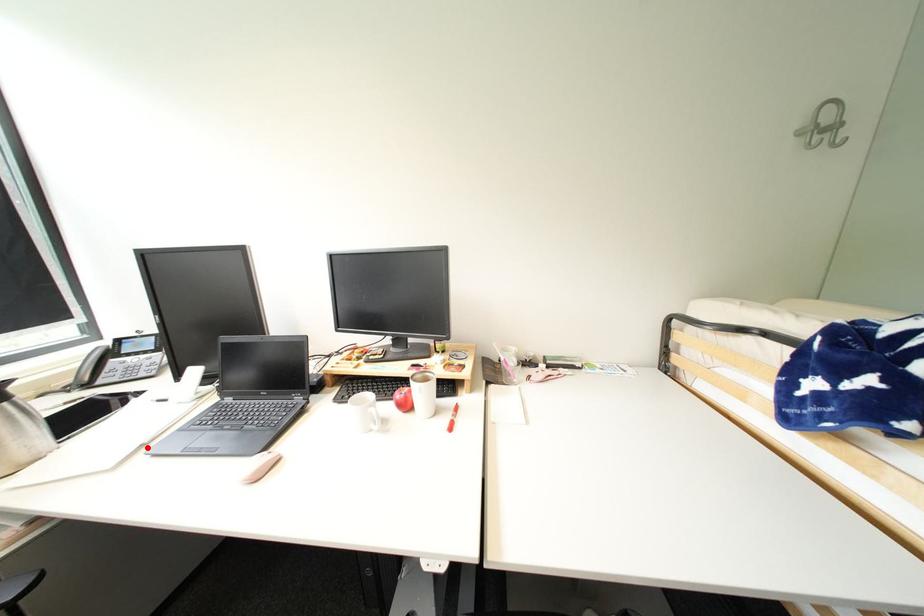
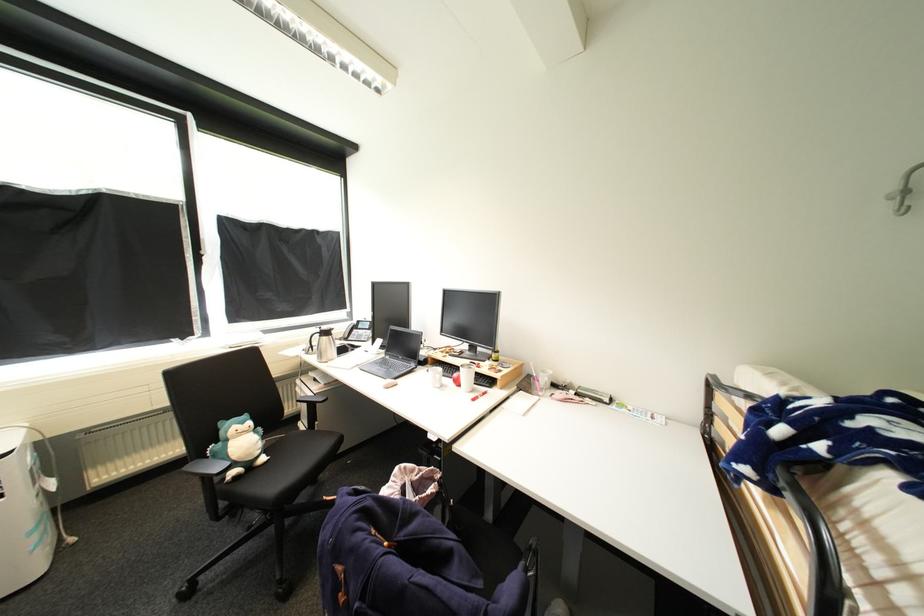
Find the pixel in the second image that matches the highlighted location in the first image.

(363, 366)